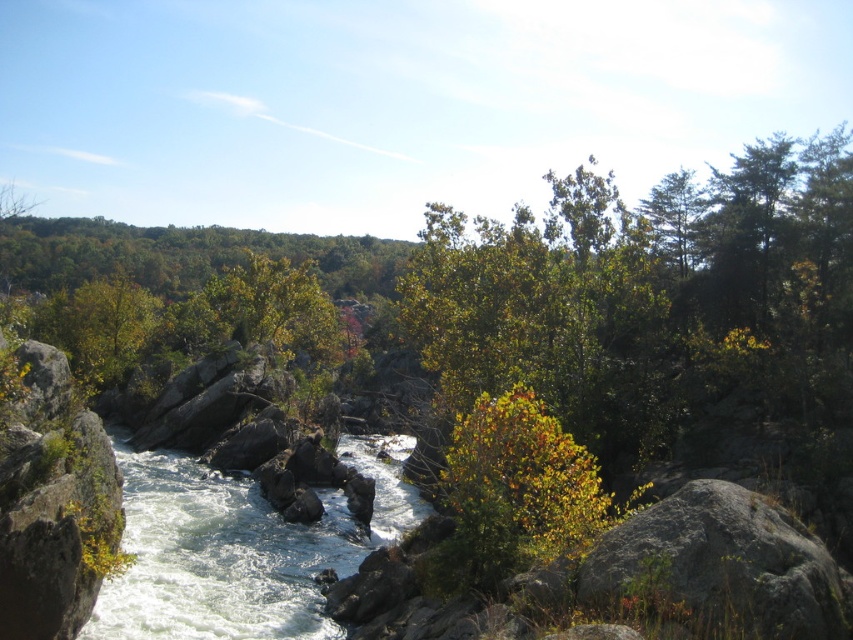
You are a hiker trying to cross the river using a narrow path. You see the white frothy water at center and the green leafy bush at center. Which object is closer to your current position if you are standing at the starting point of the path?

The green leafy bush at center is closer because it is only 27.06 feet away from the white frothy water at center, but without knowing the exact distance from your position, we can infer that since the path starts near the bush, it would be closer.

You are standing at the edge of the river and want to take a photo of the white frothy water at center. If your camera can focus on objects up to 15 meters away, will you need to move closer to capture it clearly?

The white frothy water at center is 16.68 meters away from the camera. Since the camera can only focus up to 15 meters, you need to move closer to ensure clear focus.